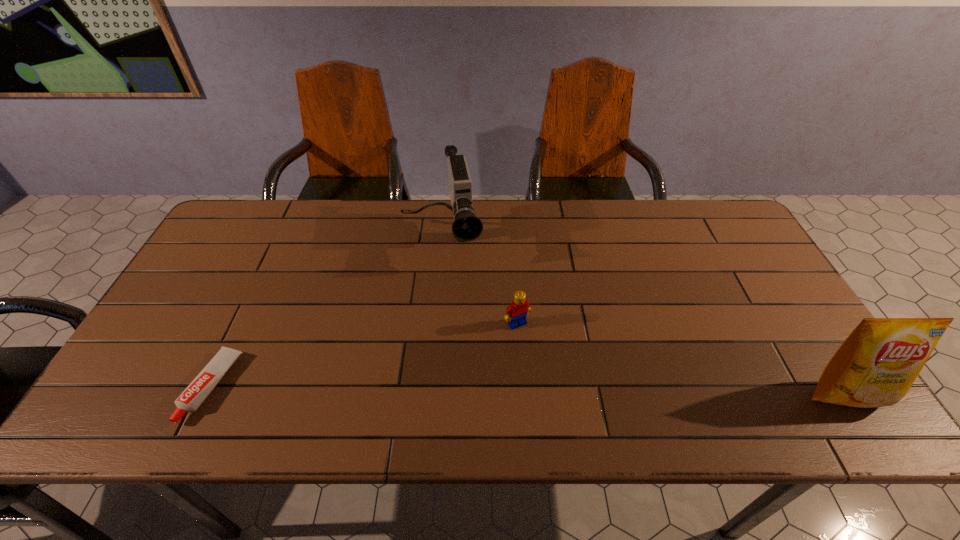
At what (x,y) coordinates should I click in order to perform the action: click on object that is at the near right corner. Please return your answer as a coordinate pair (x, y). Looking at the image, I should click on (876, 365).

Image resolution: width=960 pixels, height=540 pixels. In order to click on free location at the far edge of the desktop in this screenshot , I will do `click(482, 215)`.

Image resolution: width=960 pixels, height=540 pixels. In order to click on free space at the near edge of the desktop in this screenshot , I will do `click(352, 364)`.

In the image, there is a desktop. In order to click on vacant region at the left edge in this screenshot , I will do `click(201, 341)`.

The width and height of the screenshot is (960, 540). In the image, there is a desktop. What are the coordinates of `vacant region at the right edge` in the screenshot? It's located at (742, 321).

Image resolution: width=960 pixels, height=540 pixels. In the image, there is a desktop. Identify the location of vacant space at the far right corner. (686, 201).

You are a GUI agent. You are given a task and a screenshot of the screen. Output one action in this format:
    pyautogui.click(x=<x>, y=<y>)
    Task: Click on the vacant point located between the rightmost object and the third object from right to left
    
    Given the screenshot: What is the action you would take?
    pyautogui.click(x=643, y=316)

You are a GUI agent. You are given a task and a screenshot of the screen. Output one action in this format:
    pyautogui.click(x=<x>, y=<y>)
    Task: Click on the unoccupied position between the camcorder and the second object from right to left
    The width and height of the screenshot is (960, 540).
    Given the screenshot: What is the action you would take?
    pyautogui.click(x=479, y=281)

I want to click on unoccupied position between the second shortest object and the third object from right to left, so click(479, 281).

Locate an element on the screen. free space between the crisp (potato chip) and the third nearest object is located at coordinates (682, 359).